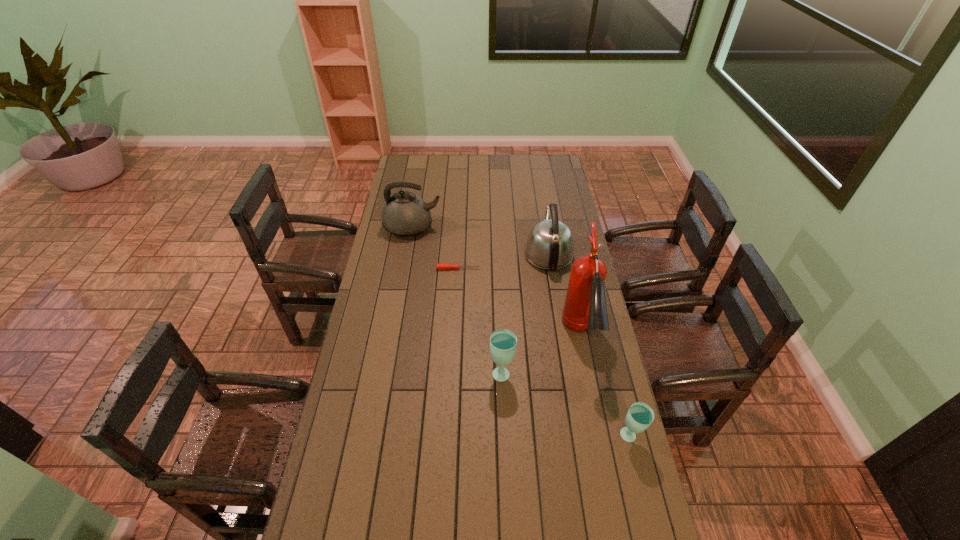
Locate an element on the screen. The image size is (960, 540). vacant space that satisfies the following two spatial constraints: 1. at the spout of the left kettle; 2. on the left side of the third shortest object is located at coordinates (388, 372).